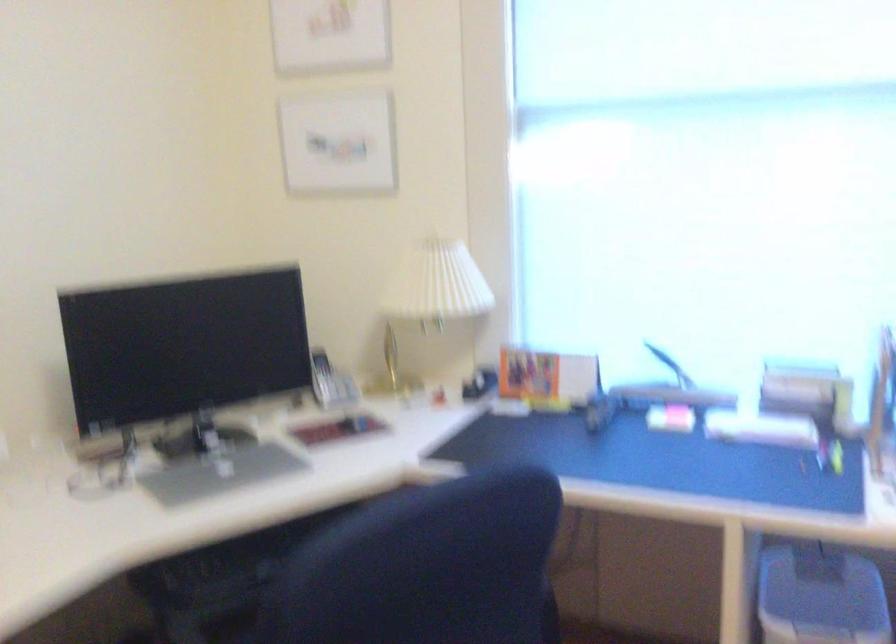
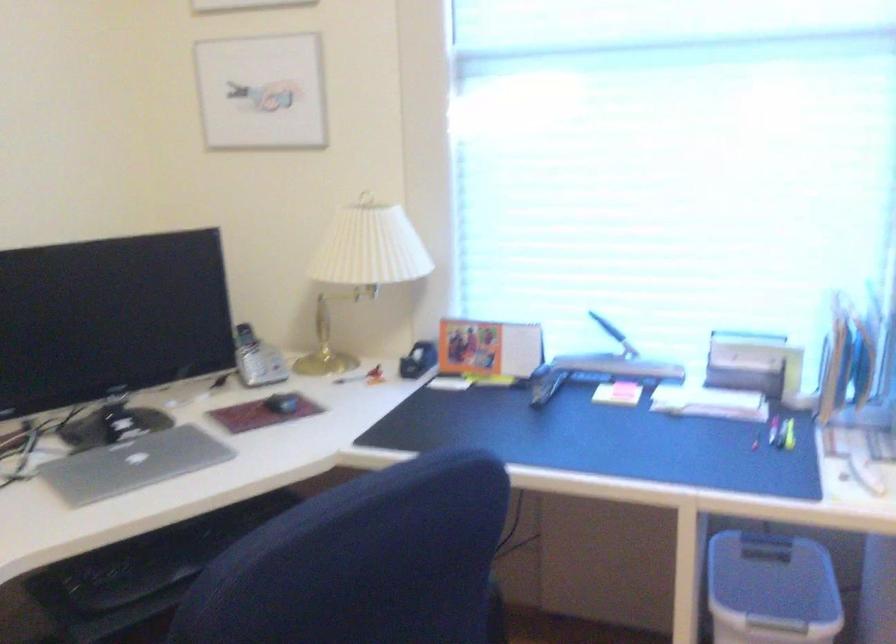
Locate, in the second image, the point that corresponds to the point at 661,355 in the first image.

(607, 327)